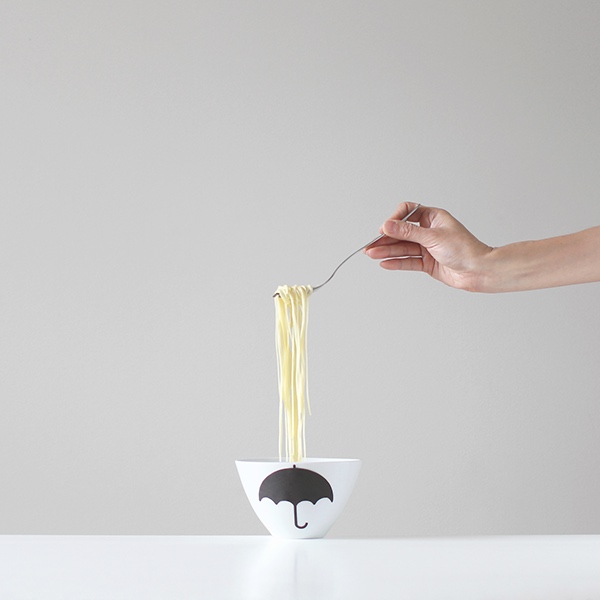
Where is `white counter`? The width and height of the screenshot is (600, 600). white counter is located at coordinates (352, 563).